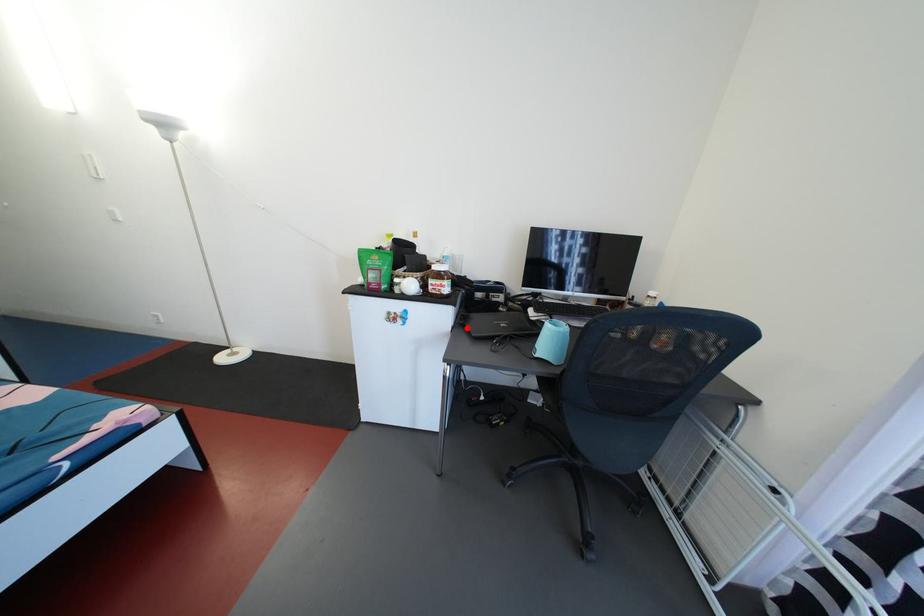
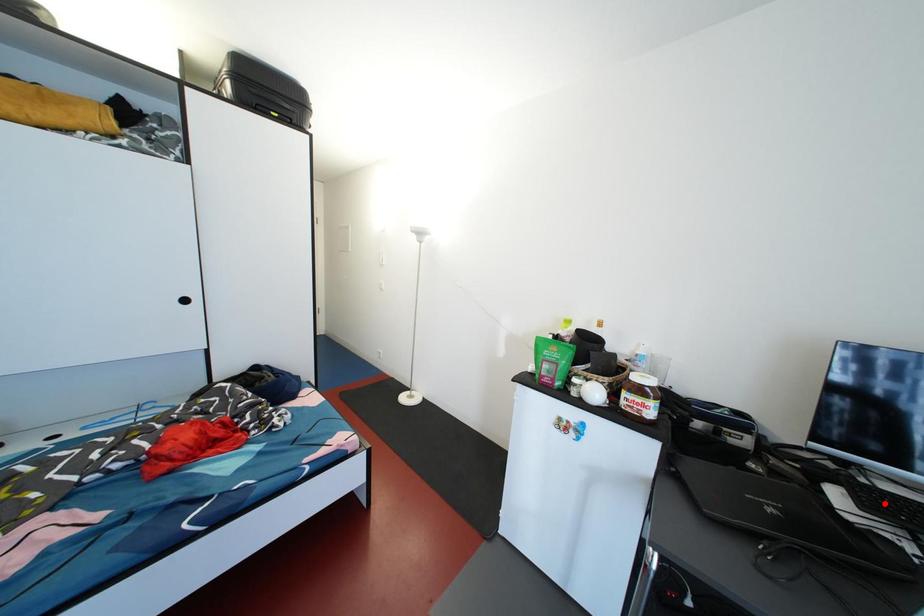
I am providing you with two images of the same scene from different viewpoints. A red point is marked on the first image and another point is marked on the second image. Is the red point in image1 aligned with the point shown in image2?

No